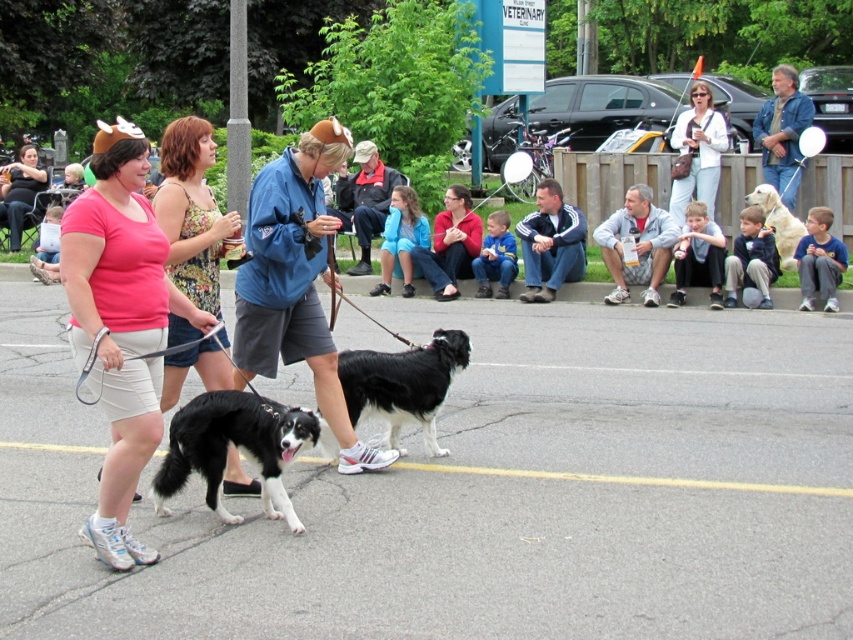
Question: Is matte pink shirt at left above blue fabric jacket at center?

Choices:
 (A) no
 (B) yes

Answer: (A)

Question: Is matte pink shirt at left positioned before matte white shirt at upper center?

Choices:
 (A) no
 (B) yes

Answer: (B)

Question: Which point is farther to the camera?

Choices:
 (A) (544, 205)
 (B) (212, 280)

Answer: (A)

Question: Which point appears farthest from the camera in this image?

Choices:
 (A) (167, 227)
 (B) (572, 205)
 (C) (308, 364)
 (D) (297, 445)

Answer: (B)

Question: Based on their relative distances, which object is farther from the black smooth dog at center?

Choices:
 (A) golden fur dog at right
 (B) matte pink shirt at left
 (C) floral tank top at center

Answer: (A)

Question: Is black smooth dog at center above matte white shirt at upper center?

Choices:
 (A) yes
 (B) no

Answer: (B)